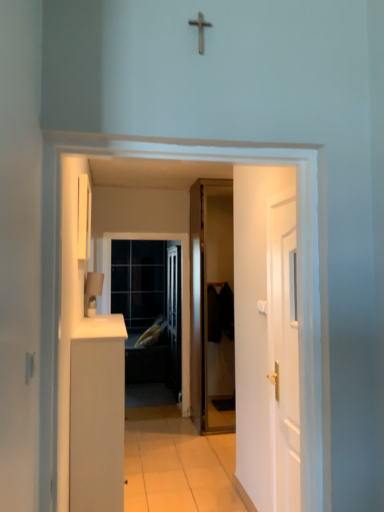
Find the location of a particular element. This screenshot has height=512, width=384. metallic cross at upper center is located at coordinates (200, 30).

This screenshot has width=384, height=512. I want to click on white matte cabinet at left, so click(97, 414).

Locate an element on the screen. The height and width of the screenshot is (512, 384). white wooden door at right, which appears as the first door when viewed from the right is located at coordinates (284, 349).

What are the coordinates of `transparent glass door at center` in the screenshot? It's located at (138, 281).

This screenshot has height=512, width=384. Describe the element at coordinates (176, 464) in the screenshot. I see `white tile floor at center` at that location.

What are the coordinates of `matte glass screen door at center` in the screenshot? It's located at (149, 308).

Considering the relative sizes of metallic cross at upper center and matte glass screen door at center in the image provided, is metallic cross at upper center smaller than matte glass screen door at center?

Yes.

Considering the points (198, 28) and (125, 294), which point is in front, point (198, 28) or point (125, 294)?

Positioned in front is point (198, 28).

Where is `screen door to the left of metallic cross at upper center`? This screenshot has width=384, height=512. screen door to the left of metallic cross at upper center is located at coordinates (149, 308).

Measure the distance between metallic cross at upper center and white tile floor at center.

metallic cross at upper center and white tile floor at center are 3.38 meters apart from each other.

Looking at their sizes, would you say metallic cross at upper center is wider or thinner than white tile floor at center?

metallic cross at upper center is thinner than white tile floor at center.

Is metallic cross at upper center not near white tile floor at center?

Indeed, metallic cross at upper center is not near white tile floor at center.

Is metallic cross at upper center facing towards white tile floor at center?

No, metallic cross at upper center is not oriented towards white tile floor at center.

Is white wooden door at right, the 2th door viewed from the back, completely or partially inside black matte door at center, the 2th door from the right?

No, white wooden door at right, the 2th door viewed from the back, is not a part of black matte door at center, the 2th door from the right.

Based on the photo, how different are the orientations of black matte door at center, positioned as the 1th door in back-to-front order, and white wooden door at right, the 2th door viewed from the back, in degrees?

89.6 degrees separate the facing orientations of black matte door at center, positioned as the 1th door in back-to-front order, and white wooden door at right, the 2th door viewed from the back.

Is white wooden door at right, which appears as the first door when viewed from the right, at the back of black matte door at center, the 1th door in the left-to-right sequence?

black matte door at center, the 1th door in the left-to-right sequence, does not have its back to white wooden door at right, which appears as the first door when viewed from the right.

Locate an element on the screen. The height and width of the screenshot is (512, 384). the 2nd door counting from the right side of the transparent glass door at center is located at coordinates (284, 349).

Does transparent glass door at center contain white wooden door at right, which appears as the first door when viewed from the right?

No, white wooden door at right, which appears as the first door when viewed from the right, is not surrounded by transparent glass door at center.

Relative to white wooden door at right, which appears as the first door when viewed from the right, is transparent glass door at center in front or behind?

Visually, transparent glass door at center is located behind white wooden door at right, which appears as the first door when viewed from the right.

From a real-world perspective, is transparent glass door at center located higher than white wooden door at right, arranged as the second door when viewed from the left?

Yes.

Considering the positions of point (200, 21) and point (217, 303), is point (200, 21) closer or farther from the camera than point (217, 303)?

Point (200, 21) is positioned closer to the camera compared to point (217, 303).

Looking at this image, between metallic cross at upper center and black matte door at center, acting as the second door starting from the front, which one appears on the left side from the viewer's perspective?

Positioned to the left is metallic cross at upper center.

From the image's perspective, is metallic cross at upper center on top of black matte door at center, the 2th door from the right?

Yes.

Is metallic cross at upper center situated inside black matte door at center, the 1th door in the left-to-right sequence, or outside?

metallic cross at upper center cannot be found inside black matte door at center, the 1th door in the left-to-right sequence.

Could you measure the distance between black matte door at center, the 2th door from the right, and white matte cabinet at left?

They are 2.12 meters apart.

Considering the relative sizes of black matte door at center, acting as the second door starting from the front, and white matte cabinet at left in the image provided, is black matte door at center, acting as the second door starting from the front, taller than white matte cabinet at left?

Yes.

From a real-world perspective, who is located higher, black matte door at center, the 1th door in the left-to-right sequence, or white matte cabinet at left?

black matte door at center, the 1th door in the left-to-right sequence, is physically above.

Can you see white wooden door at right, which is the 1th door in front-to-back order, touching black matte door at center, the 1th door in the left-to-right sequence?

No, white wooden door at right, which is the 1th door in front-to-back order, is not making contact with black matte door at center, the 1th door in the left-to-right sequence.

From the image's perspective, would you say white wooden door at right, arranged as the second door when viewed from the left, is positioned over black matte door at center, positioned as the 1th door in back-to-front order?

Incorrect, from the image's perspective, white wooden door at right, arranged as the second door when viewed from the left, is lower than black matte door at center, positioned as the 1th door in back-to-front order.

Looking at their sizes, would you say white wooden door at right, arranged as the second door when viewed from the left, is wider or thinner than black matte door at center, the 1th door in the left-to-right sequence?

Considering their sizes, white wooden door at right, arranged as the second door when viewed from the left, looks slimmer than black matte door at center, the 1th door in the left-to-right sequence.

Locate an element on the screen. The width and height of the screenshot is (384, 512). screen door below the metallic cross at upper center (from a real-world perspective) is located at coordinates (149, 308).

Where is `path behind the metallic cross at upper center`? The image size is (384, 512). path behind the metallic cross at upper center is located at coordinates (176, 464).

Considering their positions, is transparent glass door at center positioned further to matte glass screen door at center than metallic cross at upper center?

Among the two, metallic cross at upper center is located further to matte glass screen door at center.

Considering their positions, is white matte cabinet at left positioned further to metallic cross at upper center than white tile floor at center?

Based on the image, white tile floor at center appears to be further to metallic cross at upper center.

Estimate the real-world distances between objects in this image. Which object is further from white wooden door at right, which is the 1th door in front-to-back order, matte glass screen door at center or transparent glass door at center?

The object further to white wooden door at right, which is the 1th door in front-to-back order, is transparent glass door at center.

From the image, which object appears to be farther from metallic cross at upper center, transparent glass door at center or white tile floor at center?

transparent glass door at center is further to metallic cross at upper center.

Looking at the image, which one is located further to transparent glass door at center, white tile floor at center or white matte cabinet at left?

white matte cabinet at left.

Based on their spatial positions, is transparent glass door at center or black matte door at center, the 2th door from the right, closer to metallic cross at upper center?

black matte door at center, the 2th door from the right, lies closer to metallic cross at upper center than the other object.

Estimate the real-world distances between objects in this image. Which object is further from matte glass screen door at center, white matte cabinet at left or black matte door at center, acting as the second door starting from the front?

white matte cabinet at left lies further to matte glass screen door at center than the other object.

Based on their spatial positions, is white wooden door at right, the 2th door viewed from the back, or transparent glass door at center closer to metallic cross at upper center?

white wooden door at right, the 2th door viewed from the back, lies closer to metallic cross at upper center than the other object.

At what (x,y) coordinates should I click in order to perform the action: click on cabinetry between white wooden door at right, the 2th door viewed from the back, and transparent glass door at center in the front-back direction. Please return your answer as a coordinate pair (x, y). Looking at the image, I should click on (97, 414).

Find the location of a particular element. This screenshot has height=512, width=384. cabinetry between white wooden door at right, arranged as the second door when viewed from the left, and black matte door at center, acting as the second door starting from the front, from front to back is located at coordinates (97, 414).

Identify the location of path positioned between white matte cabinet at left and matte glass screen door at center from near to far. The image size is (384, 512). (176, 464).

Locate an element on the screen. path between white matte cabinet at left and black matte door at center, the 2th door from the right, from front to back is located at coordinates (176, 464).